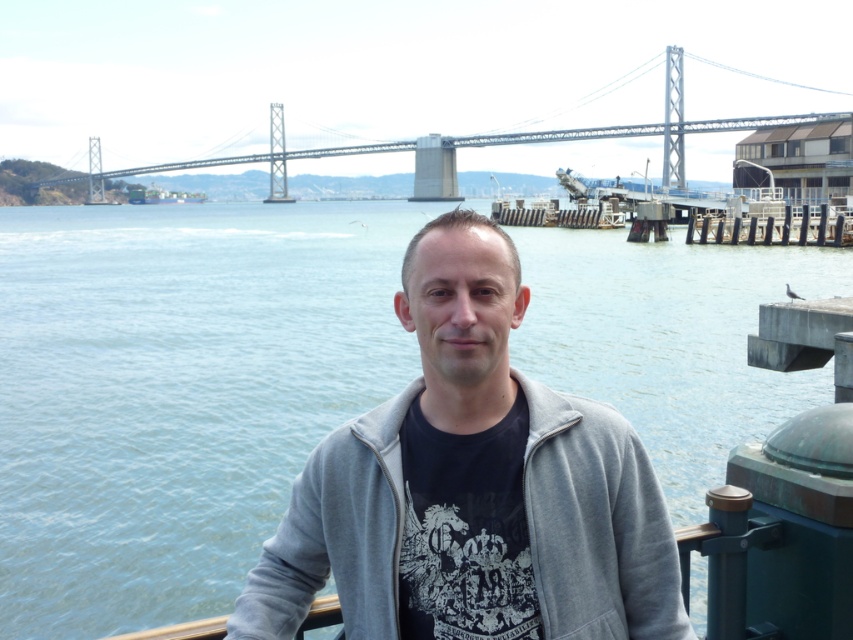
Question: Which point is closer to the camera?

Choices:
 (A) metallic gray bridge at upper center
 (B) gray fleece jacket at center

Answer: (B)

Question: Can you confirm if gray fleece jacket at center is positioned to the left of metallic gray bridge at upper center?

Choices:
 (A) no
 (B) yes

Answer: (A)

Question: Which point is farther from the camera taking this photo?

Choices:
 (A) (149, 172)
 (B) (502, 557)

Answer: (A)

Question: Does gray fleece jacket at center appear under metallic gray bridge at upper center?

Choices:
 (A) no
 (B) yes

Answer: (B)

Question: Is gray fleece jacket at center positioned in front of metallic gray bridge at upper center?

Choices:
 (A) no
 (B) yes

Answer: (B)